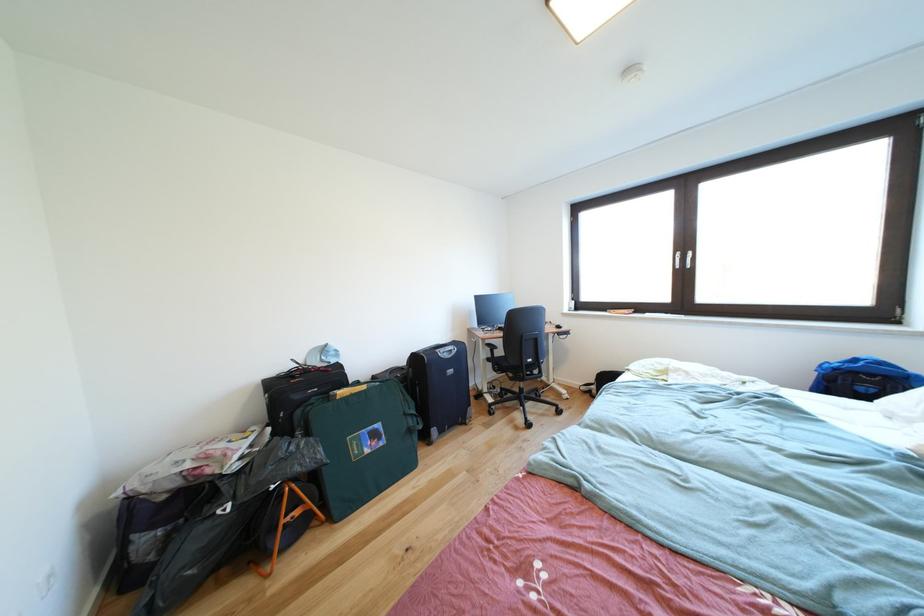
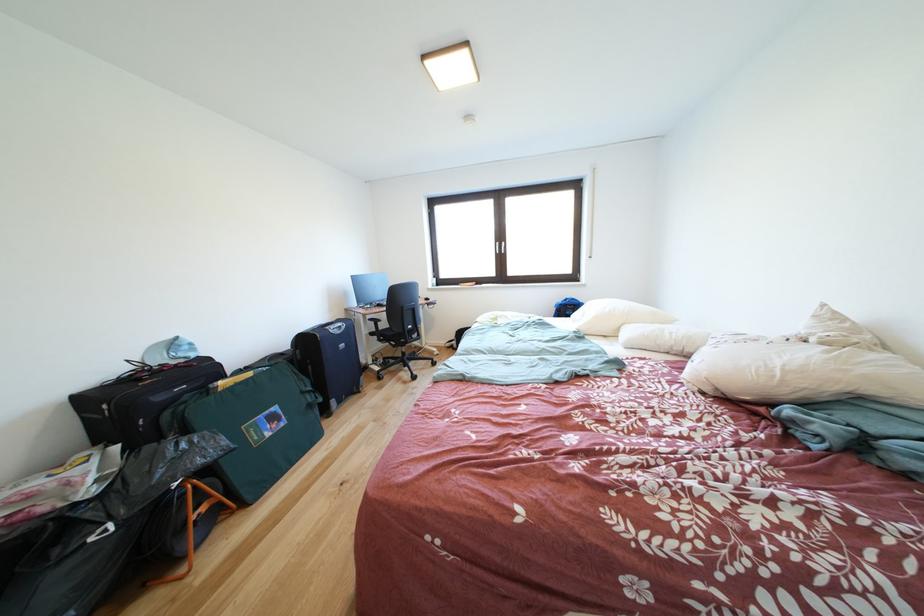
In the second image, find the point that corresponds to (x=687, y=259) in the first image.

(505, 249)